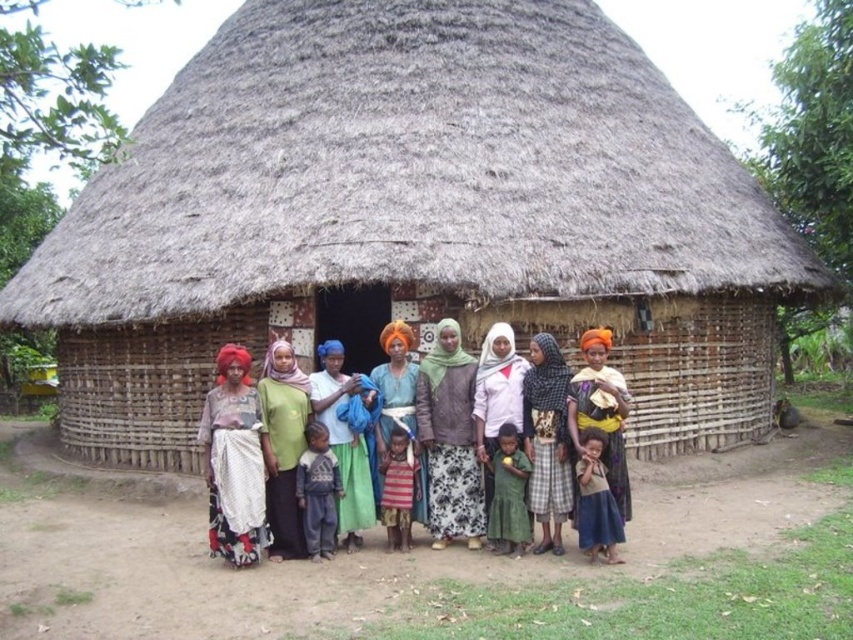
Question: Which of the following is the closest to the observer?

Choices:
 (A) (410, 419)
 (B) (288, 372)

Answer: (B)

Question: Which point is farther to the camera?

Choices:
 (A) checkered fabric dress at center
 (B) green fabric at center
 (C) light brown fabric dress at lower right
 (D) orange fabric headscarf at center

Answer: (B)

Question: Among these objects, which one is farthest from the camera?

Choices:
 (A) blue fabric at center
 (B) brown thatch at center
 (C) light brown fabric dress at lower right

Answer: (B)

Question: Does brown thatch at center have a lesser width compared to light brown fabric dress at lower right?

Choices:
 (A) no
 (B) yes

Answer: (A)

Question: Is white cotton dress at center closer to the viewer compared to dark blue fabric pants at center?

Choices:
 (A) no
 (B) yes

Answer: (B)

Question: Is brown thatch at center bigger than multicolored woven cloth at center?

Choices:
 (A) no
 (B) yes

Answer: (B)